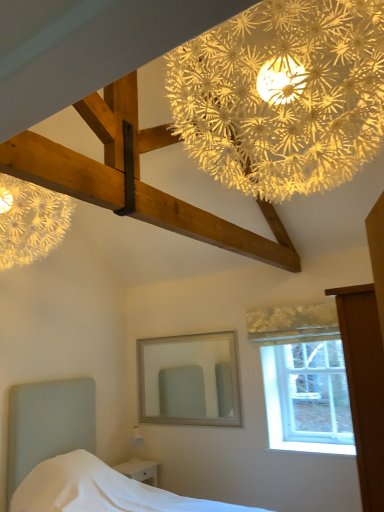
Question: Is clear glass window at upper right spatially inside illuminated paper flower at upper center, or outside of it?

Choices:
 (A) inside
 (B) outside

Answer: (B)

Question: From the image's perspective, is clear glass window at upper right positioned above or below illuminated paper flower at upper center?

Choices:
 (A) below
 (B) above

Answer: (A)

Question: Considering the real-world distances, which object is closest to the clear glass window at upper right?

Choices:
 (A) white wooden mirror at center
 (B) white glossy nightstand at lower left
 (C) white fabric bed at lower left
 (D) illuminated paper flower at upper center

Answer: (A)

Question: Which object is the closest to the white glossy nightstand at lower left?

Choices:
 (A) white wooden mirror at center
 (B) white fabric bed at lower left
 (C) clear glass window at upper right
 (D) illuminated paper flower at upper center

Answer: (B)